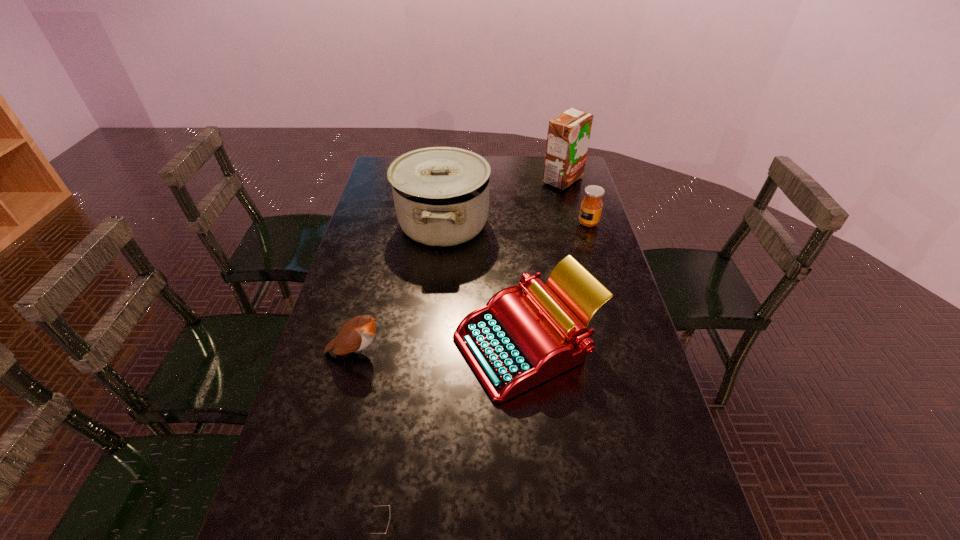
Locate an element on the screen. The height and width of the screenshot is (540, 960). typewriter situated at the right edge is located at coordinates (518, 340).

Identify the location of honey that is at the right edge. The height and width of the screenshot is (540, 960). (591, 207).

You are a GUI agent. You are given a task and a screenshot of the screen. Output one action in this format:
    pyautogui.click(x=<x>, y=<y>)
    Task: Click on the object that is at the far right corner
    This screenshot has height=540, width=960.
    Given the screenshot: What is the action you would take?
    pyautogui.click(x=568, y=136)

Where is `free region at the far edge of the desktop`? The image size is (960, 540). free region at the far edge of the desktop is located at coordinates (527, 175).

Find the location of a particular element. The image size is (960, 540). vacant space at the left edge of the desktop is located at coordinates (382, 254).

This screenshot has width=960, height=540. I want to click on vacant region at the right edge of the desktop, so click(x=596, y=365).

Identify the location of empty space that is in between the honey and the bird. (472, 287).

At what (x,y) coordinates should I click in order to perform the action: click on vacant space that's between the bird and the honey. Please return your answer as a coordinate pair (x, y). Looking at the image, I should click on (472, 287).

Identify the location of free spot between the carton and the honey. (575, 201).

This screenshot has width=960, height=540. In order to click on vacant space in between the fifth shortest object and the bird in this screenshot , I will do `click(399, 288)`.